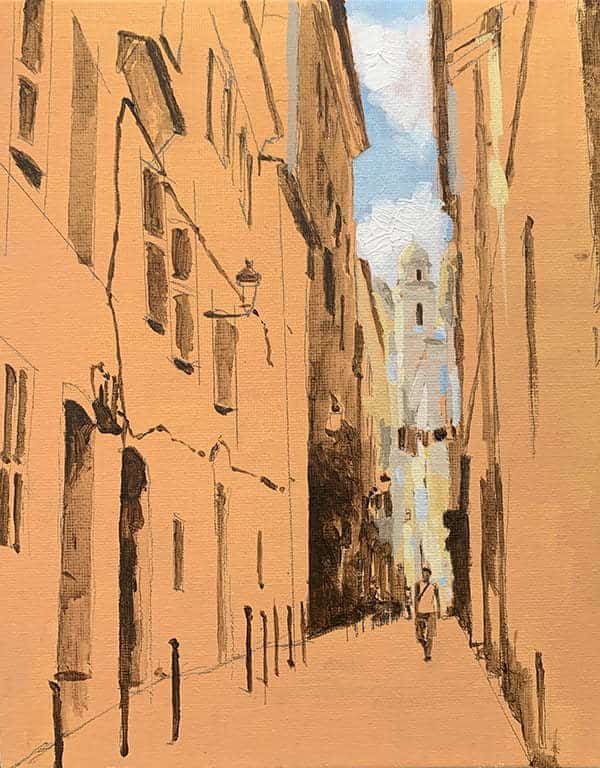
The image size is (600, 768). Identify the location of doorway. (135, 533).